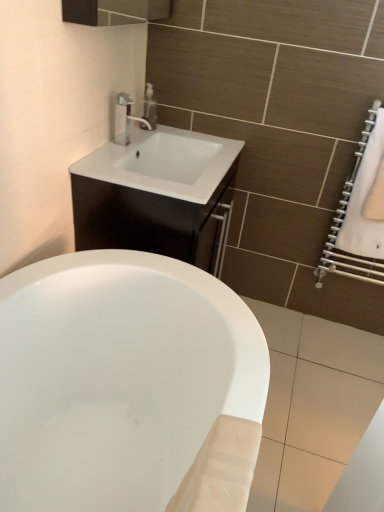
Question: Looking at their shapes, would you say matte silver soap dispenser at upper center is wider or thinner than white fabric towel at right?

Choices:
 (A) wide
 (B) thin

Answer: (A)

Question: Relative to white fabric towel at right, is matte silver soap dispenser at upper center in front or behind?

Choices:
 (A) behind
 (B) front

Answer: (A)

Question: Which object is the farthest from the satin nickel faucet at upper center?

Choices:
 (A) white glossy cabinet at upper center
 (B) matte silver soap dispenser at upper center
 (C) white fabric towel at right

Answer: (C)

Question: Which object is the farthest from the white glossy cabinet at upper center?

Choices:
 (A) white fabric towel at right
 (B) matte silver soap dispenser at upper center
 (C) satin nickel faucet at upper center

Answer: (A)